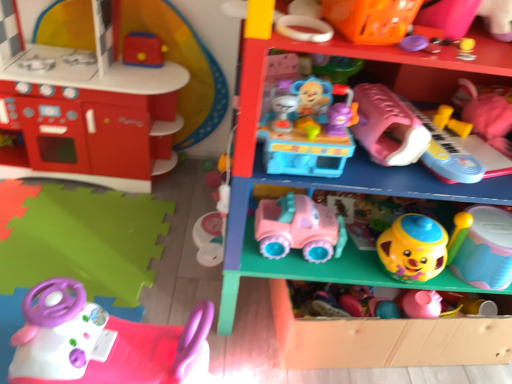
The height and width of the screenshot is (384, 512). What are the coordinates of `vacant space that's between pink plastic toy car at center, placed as the 1th shelf when sorted from top to bottom, and matte red kitchen set at left, the 11th toy viewed from the right` in the screenshot? It's located at (117, 232).